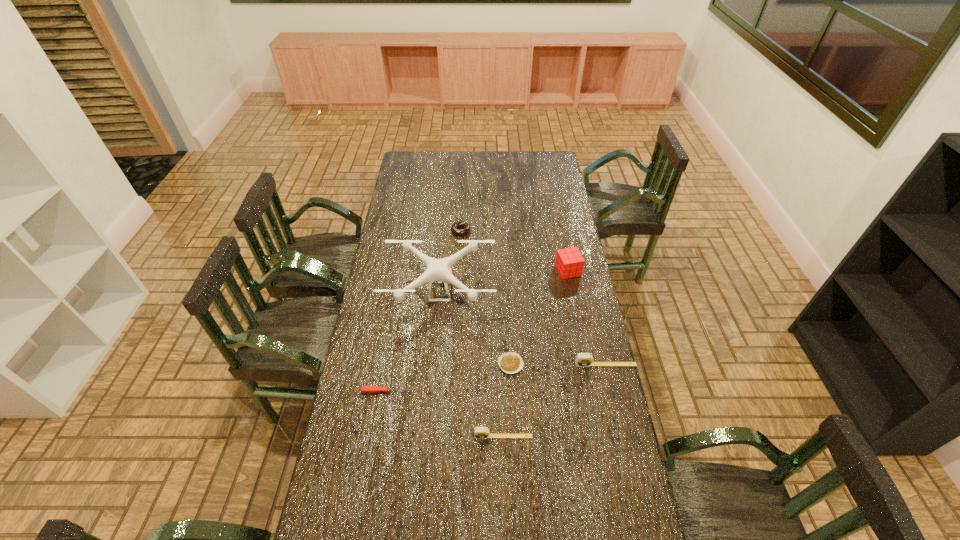
The height and width of the screenshot is (540, 960). I want to click on unoccupied area between the doughnut and the fourth tallest object, so click(482, 334).

The width and height of the screenshot is (960, 540). What are the coordinates of `vacant area that lies between the taller tape measure and the second tallest object` in the screenshot? It's located at (587, 318).

This screenshot has width=960, height=540. What are the coordinates of `unoccupied area between the sixth farthest object and the shorter tape measure` in the screenshot? It's located at (445, 414).

The width and height of the screenshot is (960, 540). In order to click on empty space that is in between the second nearest object and the right tape measure in this screenshot , I will do `click(496, 378)`.

Identify the location of free space that is in between the right tape measure and the doughnut. This screenshot has width=960, height=540. (533, 298).

Choose which object is the second nearest neighbor to the fifth tallest object. Please provide its 2D coordinates. Your answer should be formatted as a tuple, i.e. [(x, y)], where the tuple contains the x and y coordinates of a point satisfying the conditions above.

[(569, 262)]

Locate which object ranks third in proximity to the cube. Please provide its 2D coordinates. Your answer should be formatted as a tuple, i.e. [(x, y)], where the tuple contains the x and y coordinates of a point satisfying the conditions above.

[(582, 359)]

The width and height of the screenshot is (960, 540). I want to click on vacant area that satisfies the following two spatial constraints: 1. on the front side of the shortest object; 2. on the left side of the doughnut, so click(x=454, y=364).